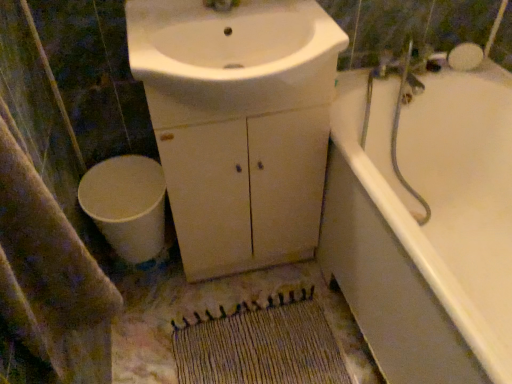
Question: From the image's perspective, is white matte toilet at lower left above or below white glossy sink at center?

Choices:
 (A) below
 (B) above

Answer: (A)

Question: Considering the positions of white matte toilet at lower left and white glossy sink at center in the image, is white matte toilet at lower left taller or shorter than white glossy sink at center?

Choices:
 (A) tall
 (B) short

Answer: (A)

Question: Which is nearer to the white matte cabinet at center?

Choices:
 (A) woven beige mat at lower center
 (B) white glossy sink at center
 (C) white glossy bathtub at right
 (D) white matte toilet at lower left
 (E) beige textured bath towel at lower left

Answer: (B)

Question: Which object is the farthest from the white matte toilet at lower left?

Choices:
 (A) white glossy sink at center
 (B) white matte cabinet at center
 (C) beige textured bath towel at lower left
 (D) white glossy bathtub at right
 (E) woven beige mat at lower center

Answer: (D)